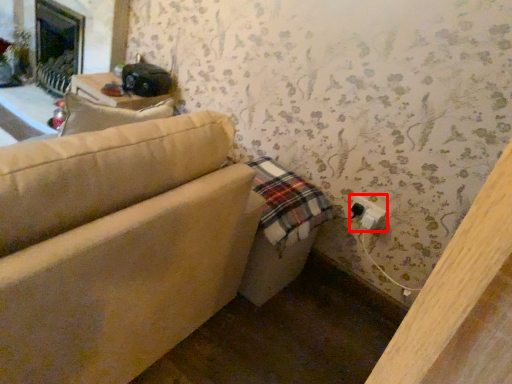
Question: From the image's perspective, what is the correct spatial positioning of electric outlet (annotated by the red box) in reference to studio couch?

Choices:
 (A) above
 (B) below

Answer: (B)